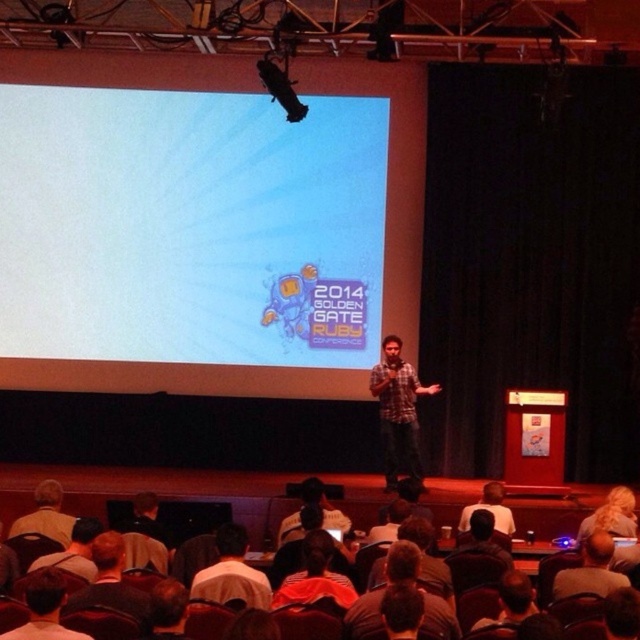
You are an attendee at the 2014 Golden Gate Ruby Conference. You notice the white matte projection screen at upper center and the dark brown leather jacket at lower left. Which object is closer to the front of the stage?

The dark brown leather jacket at lower left is behind the white matte projection screen at upper center, so the projection screen is closer to the front of the stage.

You are an attendee at the 2014 Golden Gate Ruby Conference. You notice two points marked on the stage. The first point is at coordinates point [104,589], and the second point is at point [298,524]. Which point is closer to the speaker?

Point [104,589] is in front of point [298,524], so it is closer to the speaker.

You are an attendee at the 2014 Golden Gate Ruby Conference. You notice a point on the speaker at coordinates (397, 412). What is the color of the fabric at that point?

The point at coordinates (397, 412) corresponds to the plaid fabric shirt at center, which is plaid in pattern but the color is not specified in the scene description. However, since the plaid shirt is mentioned, the color would be that of the plaid fabric.